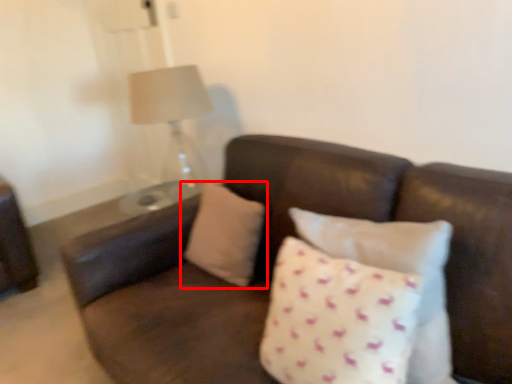
Question: Observing the image, what is the correct spatial positioning of pillow (annotated by the red box) in reference to pillow?

Choices:
 (A) right
 (B) left

Answer: (B)